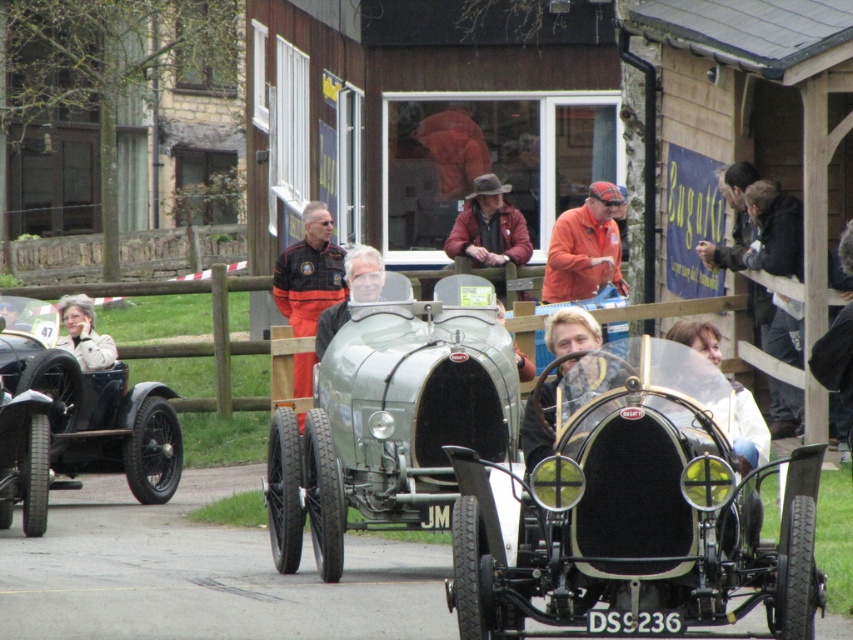
You are a photographer at the vintage car event and want to take a photo of both jackets. Since the orange fabric jacket at center and the orange softshell jacket at center are both at the center, which one should you focus on first to ensure both are in frame?

The orange fabric jacket at center is smaller than the orange softshell jacket at center, so you should focus on the orange softshell jacket at center first to ensure both are in frame.

From the picture: You are standing at the entrance of the vintage car event and want to take a photo of the shiny black car at left. Based on its position, which direction should you move to get a better view?

The shiny black car at left is located at point (91, 404), so you should move to your left to get a better view.

You are a photographer standing in the middle of the vintage car event. You want to take a photo of the shiny black car at left and the orange fabric jacket at center. Since you have a limited frame, you need to know which object is taller to prioritize composition. Which one is taller?

The shiny black car at left is taller than the orange fabric jacket at center, so prioritize the shiny black car at left in your composition.